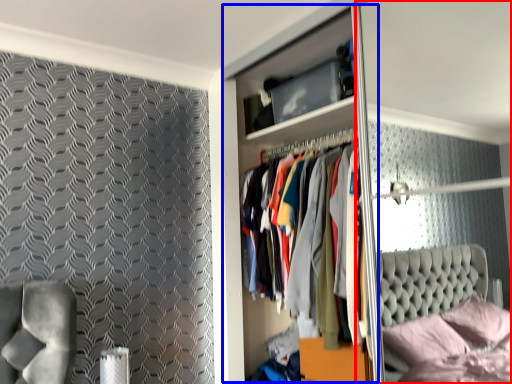
Question: Which of the following is the farthest to the observer, glass door (highlighted by a red box) or dresser (highlighted by a blue box)?

Choices:
 (A) glass door
 (B) dresser

Answer: (B)